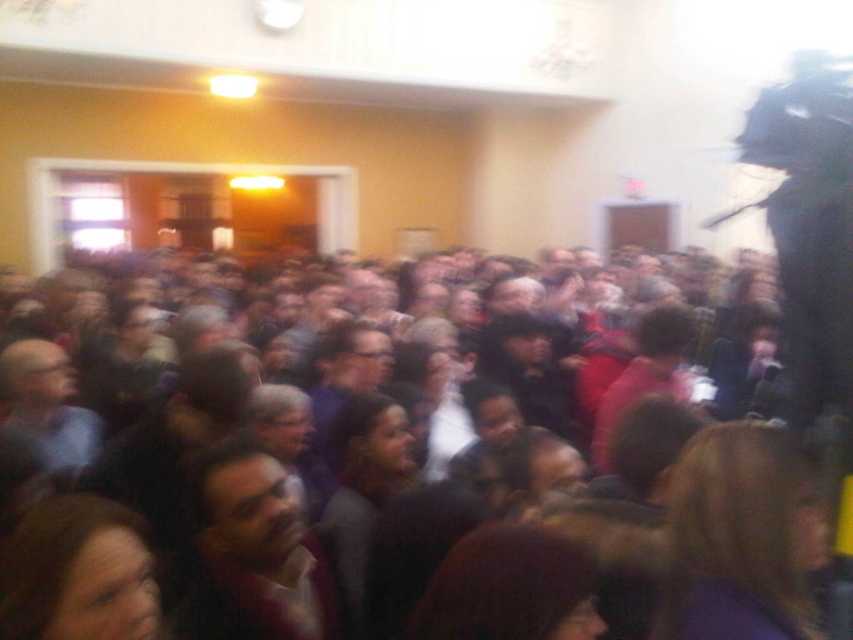
Question: Based on their relative distances, which object is nearer to the dark brown hair at center?

Choices:
 (A) smooth brown shirt at center
 (B) smooth gray shirt at left

Answer: (B)

Question: Is smooth brown shirt at center above smooth gray shirt at left?

Choices:
 (A) no
 (B) yes

Answer: (A)

Question: Can you confirm if smooth brown shirt at center is positioned below smooth gray shirt at left?

Choices:
 (A) yes
 (B) no

Answer: (A)

Question: Which is nearer to the dark brown hair at center?

Choices:
 (A) smooth gray shirt at left
 (B) smooth brown shirt at center

Answer: (A)

Question: Is dark brown hair at center above smooth brown shirt at center?

Choices:
 (A) yes
 (B) no

Answer: (A)

Question: Estimate the real-world distances between objects in this image. Which object is farther from the smooth brown shirt at center?

Choices:
 (A) dark brown hair at center
 (B) smooth gray shirt at left

Answer: (A)